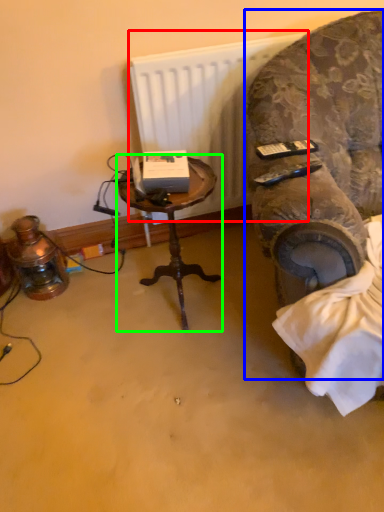
Question: Based on their relative distances, which object is nearer to radiator (highlighted by a red box)? Choose from chair (highlighted by a blue box) and table (highlighted by a green box).

Choices:
 (A) chair
 (B) table

Answer: (A)